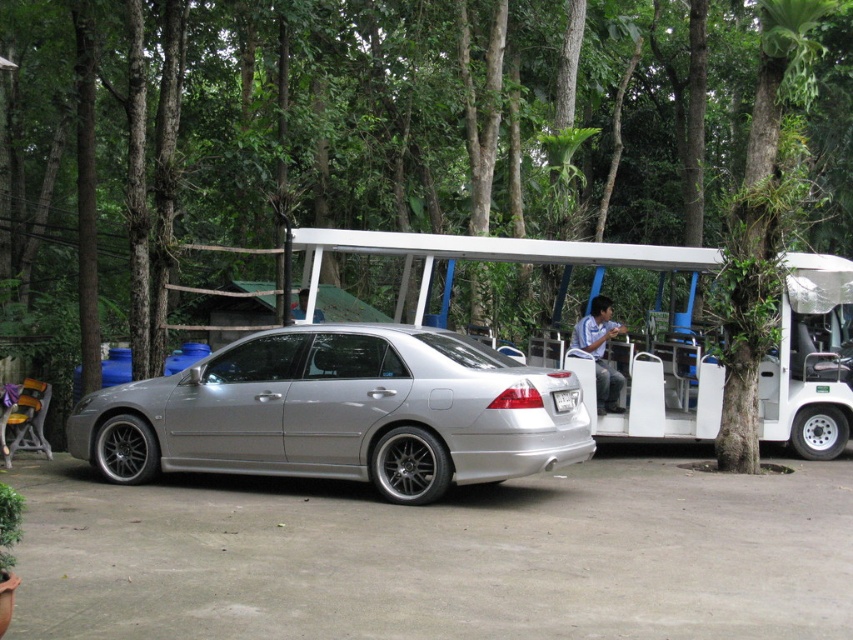
Measure the distance between point (614, 266) and camera.

Point (614, 266) and camera are 12.02 meters apart.

How much distance is there between white plastic golf cart at center and blue striped shirt at center?

white plastic golf cart at center and blue striped shirt at center are 1.52 meters apart.

You are a GUI agent. You are given a task and a screenshot of the screen. Output one action in this format:
    pyautogui.click(x=<x>, y=<y>)
    Task: Click on the white plastic golf cart at center
    
    Given the screenshot: What is the action you would take?
    (808, 362)

At what (x,y) coordinates should I click in order to perform the action: click on white plastic golf cart at center. Please return your answer as a coordinate pair (x, y). Looking at the image, I should click on (808, 362).

Looking at this image, who is higher up, white plastic golf cart at center or white plastic license plate at rear?

Positioned higher is white plastic license plate at rear.

Does white plastic golf cart at center appear on the right side of white plastic license plate at rear?

Correct, you'll find white plastic golf cart at center to the right of white plastic license plate at rear.

This screenshot has width=853, height=640. What are the coordinates of `white plastic golf cart at center` in the screenshot? It's located at (808, 362).

Between green leafy tree at center and blue fabric shirt at center, which one has less height?

blue fabric shirt at center is shorter.

Does green leafy tree at center appear under blue fabric shirt at center?

No, green leafy tree at center is not below blue fabric shirt at center.

Is point (132, 307) positioned behind point (300, 291)?

No, it is in front of (300, 291).

Image resolution: width=853 pixels, height=640 pixels. Identify the location of green leafy tree at center. (341, 136).